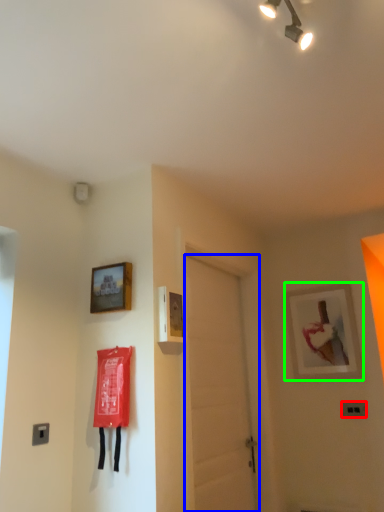
Question: Estimate the real-world distances between objects in this image. Which object is farther from light switch (highlighted by a red box), door (highlighted by a blue box) or picture frame (highlighted by a green box)?

Choices:
 (A) door
 (B) picture frame

Answer: (A)